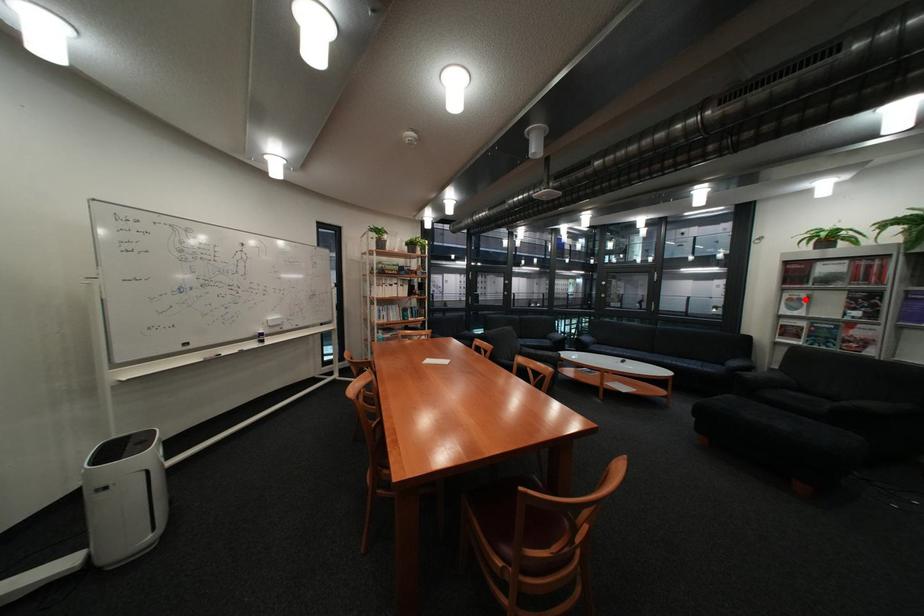
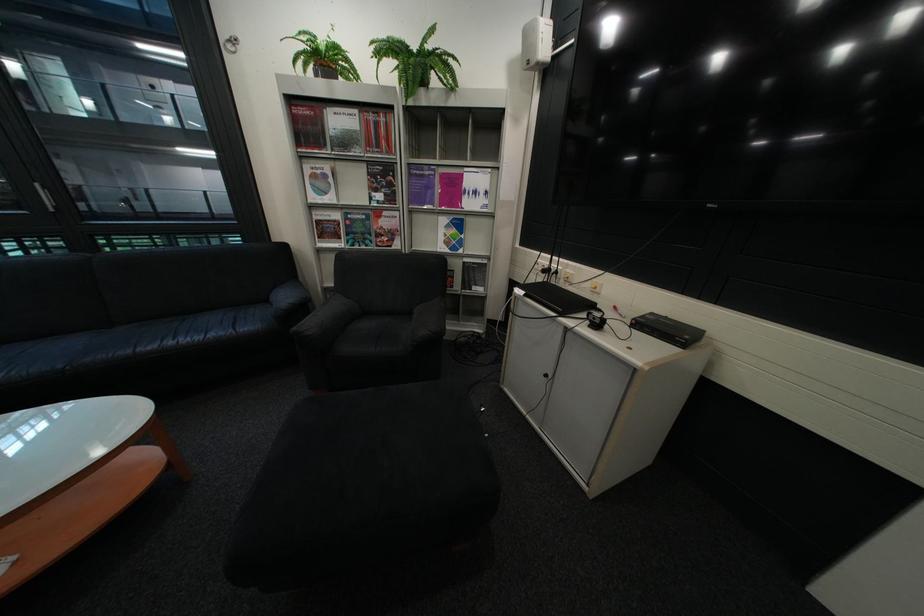
Question: I am providing you with two images of the same scene from different viewpoints. A red point is shown in image1. For the corresponding object point in image2, is it positioned nearer or farther from the camera?

Choices:
 (A) Nearer
 (B) Farther

Answer: (A)